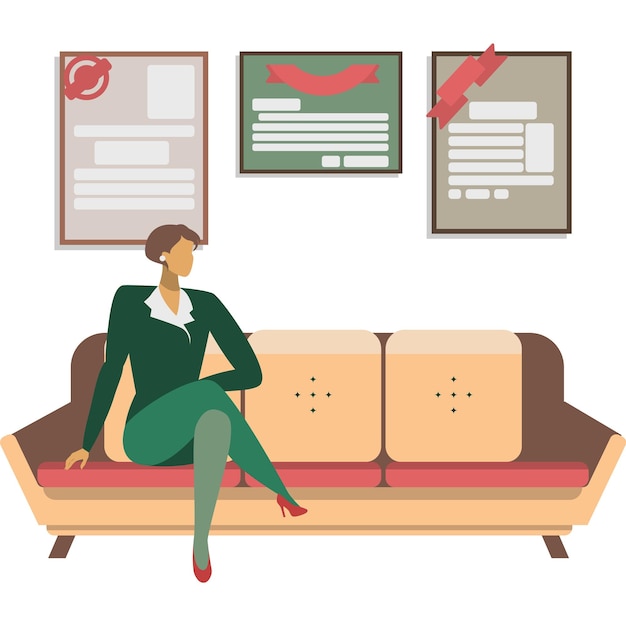
Find the location of `square couch pillows`. square couch pillows is located at coordinates (506, 371), (357, 374), (213, 362).